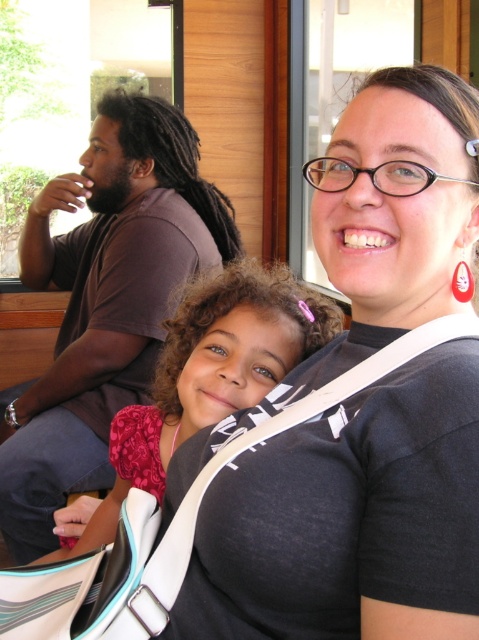
Is black matte shirt at center bigger than brown cotton shirt at left?

No.

Is black matte shirt at center behind brown cotton shirt at left?

No, it is not.

Between point (234, 465) and point (117, 320), which one is positioned behind?

The point (117, 320) is more distant.

The image size is (479, 640). What are the coordinates of `black matte shirt at center` in the screenshot? It's located at (349, 518).

Is black matte shirt at center below pink fabric at center?

No, black matte shirt at center is not below pink fabric at center.

Does black matte shirt at center have a greater height compared to pink fabric at center?

Correct, black matte shirt at center is much taller as pink fabric at center.

Locate an element on the screen. The image size is (479, 640). black matte shirt at center is located at coordinates (349, 518).

The width and height of the screenshot is (479, 640). In order to click on black matte shirt at center in this screenshot , I will do `click(349, 518)`.

Does brown cotton shirt at left appear on the left side of pink fabric at center?

Correct, you'll find brown cotton shirt at left to the left of pink fabric at center.

Which is above, brown cotton shirt at left or pink fabric at center?

brown cotton shirt at left

I want to click on brown cotton shirt at left, so click(x=104, y=301).